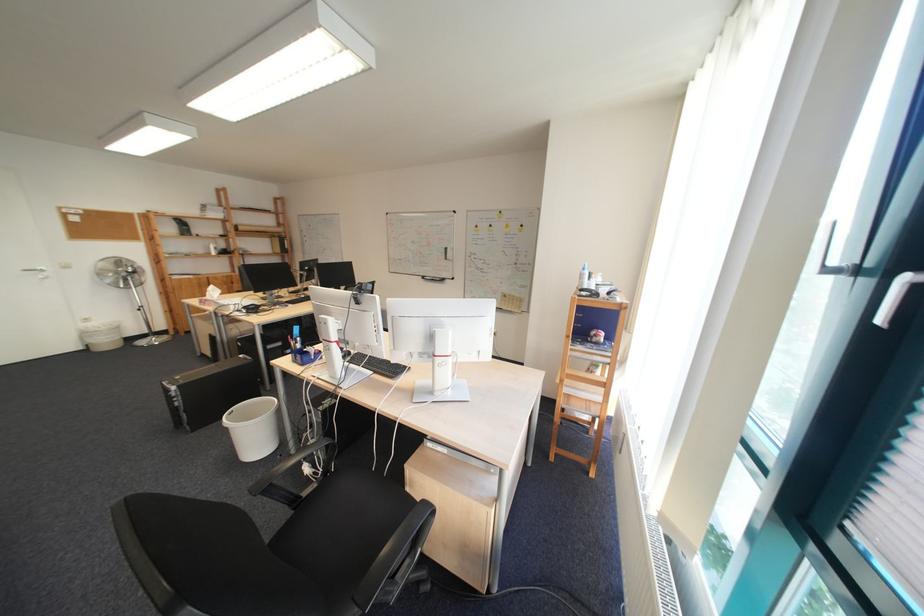
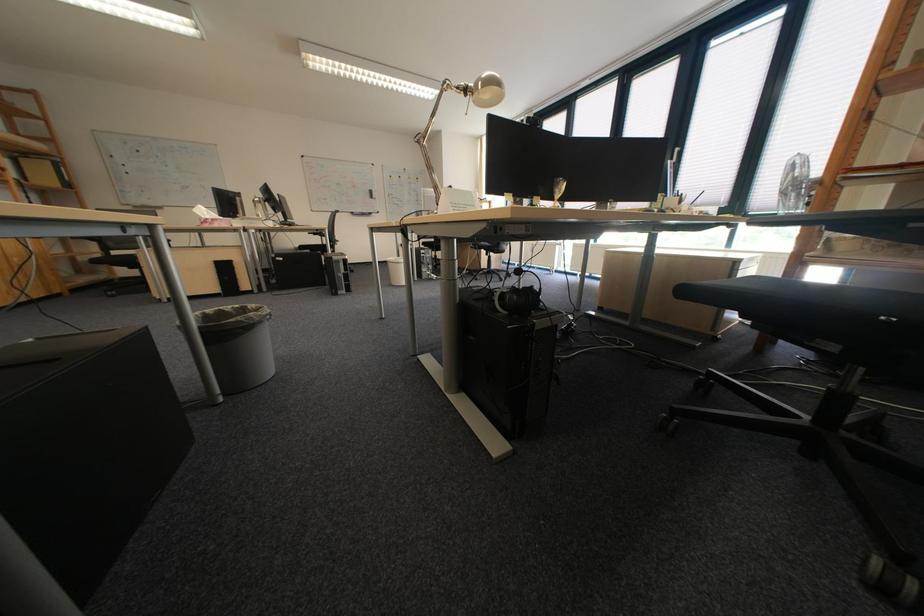
The point at [219,305] is marked in the first image. Where is the corresponding point in the second image?

(225, 225)